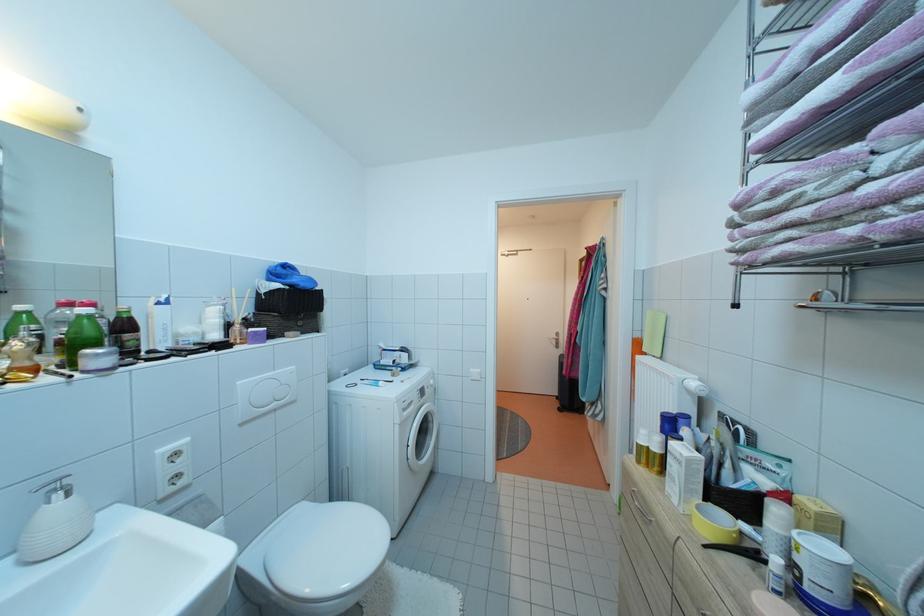
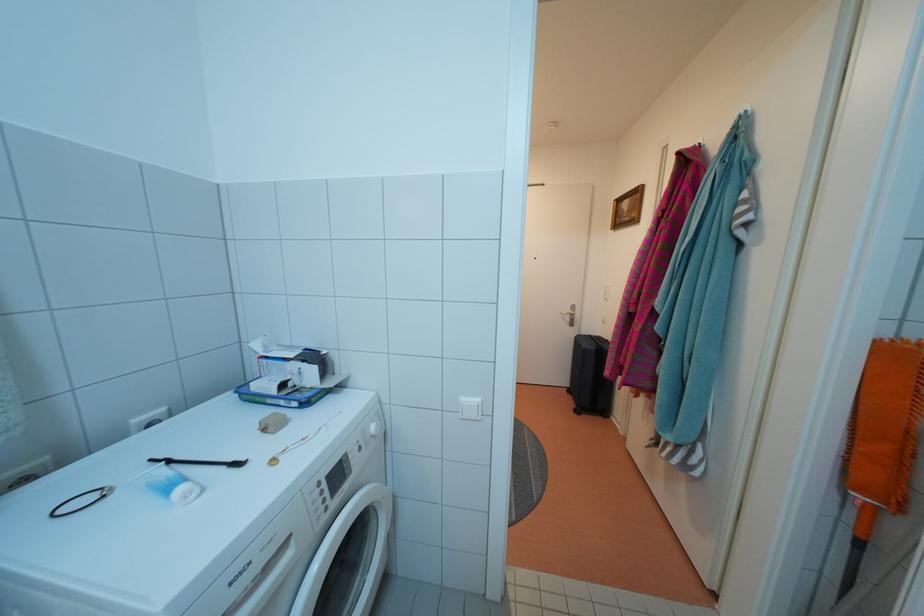
Locate, in the second image, the point that corresponds to point 439,387 in the first image.

(380, 434)